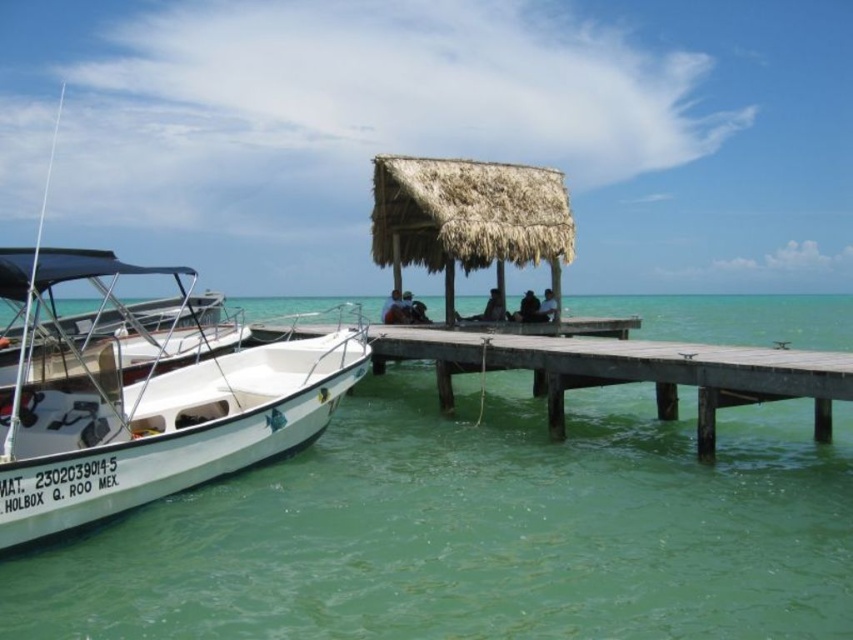
Is dark gray fabric shirt at center smaller than dark brown hair at center?

Yes.

Which of these two, dark gray fabric shirt at center or dark brown hair at center, stands shorter?

dark gray fabric shirt at center is shorter.

Between point (503, 308) and point (538, 312), which one is positioned in front?

Positioned in front is point (538, 312).

This screenshot has width=853, height=640. I want to click on dark gray fabric shirt at center, so click(494, 307).

From the picture: Who is shorter, white matte boat at left or smooth tan skin at center?

Standing shorter between the two is smooth tan skin at center.

In the scene shown: Who is taller, white matte boat at left or smooth tan skin at center?

white matte boat at left

Between point (253, 342) and point (399, 300), which one is positioned behind?

Positioned behind is point (399, 300).

This screenshot has width=853, height=640. I want to click on white matte boat at left, so click(143, 394).

Is white matte boat at left further to camera compared to dark brown hair at center?

No, it is in front of dark brown hair at center.

Does white matte boat at left appear on the right side of dark brown hair at center?

Incorrect, white matte boat at left is not on the right side of dark brown hair at center.

Describe the element at coordinates (143, 394) in the screenshot. I see `white matte boat at left` at that location.

Identify the location of white matte boat at left. The image size is (853, 640). (143, 394).